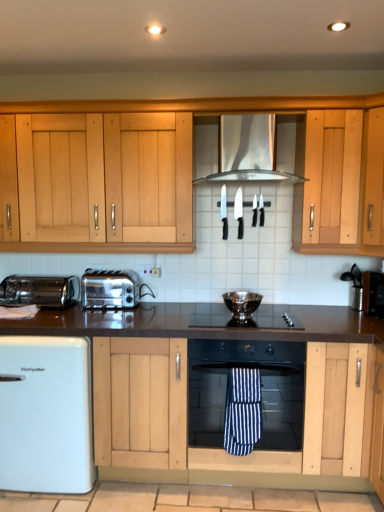
Question: Can you confirm if silver metallic vent at center is smaller than black glass gas stove at center?

Choices:
 (A) no
 (B) yes

Answer: (A)

Question: Is silver metallic vent at center positioned in front of black glass gas stove at center?

Choices:
 (A) yes
 (B) no

Answer: (A)

Question: Could black glass gas stove at center be considered to be inside silver metallic vent at center?

Choices:
 (A) no
 (B) yes

Answer: (A)

Question: Is silver metallic vent at center at the right side of black glass gas stove at center?

Choices:
 (A) yes
 (B) no

Answer: (B)

Question: Is silver metallic vent at center turned away from black glass gas stove at center?

Choices:
 (A) no
 (B) yes

Answer: (A)

Question: Considering the relative sizes of silver metallic vent at center and black glass gas stove at center in the image provided, is silver metallic vent at center taller than black glass gas stove at center?

Choices:
 (A) yes
 (B) no

Answer: (A)

Question: From the image's perspective, does metallic black toaster at right, marked as the 1th appliance in a right-to-left arrangement, appear lower than black plastic knife at center, the third appliance in the left-to-right sequence?

Choices:
 (A) yes
 (B) no

Answer: (A)

Question: Is metallic black toaster at right, acting as the 7th appliance starting from the left, not close to black plastic knife at center, the third appliance in the left-to-right sequence?

Choices:
 (A) no
 (B) yes

Answer: (A)

Question: Does metallic black toaster at right, acting as the 7th appliance starting from the left, have a lesser height compared to black plastic knife at center, the fifth appliance in the right-to-left sequence?

Choices:
 (A) no
 (B) yes

Answer: (B)

Question: Is metallic black toaster at right, marked as the 1th appliance in a right-to-left arrangement, positioned behind black plastic knife at center, the third appliance in the left-to-right sequence?

Choices:
 (A) yes
 (B) no

Answer: (B)

Question: Is metallic black toaster at right, marked as the 1th appliance in a right-to-left arrangement, to the left of black plastic knife at center, the fifth appliance in the right-to-left sequence, from the viewer's perspective?

Choices:
 (A) no
 (B) yes

Answer: (A)

Question: Considering the relative sizes of metallic black toaster at right, acting as the 7th appliance starting from the left, and black plastic knife at center, the fifth appliance in the right-to-left sequence, in the image provided, is metallic black toaster at right, acting as the 7th appliance starting from the left, wider than black plastic knife at center, the fifth appliance in the right-to-left sequence,?

Choices:
 (A) no
 (B) yes

Answer: (B)

Question: From a real-world perspective, is black granite countertop at center located higher than metallic silver toaster at left?

Choices:
 (A) no
 (B) yes

Answer: (A)